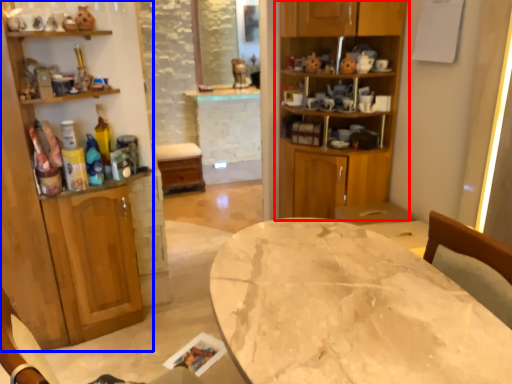
Question: Which object appears closest to the camera in this image, cabinetry (highlighted by a red box) or cabinetry (highlighted by a blue box)?

Choices:
 (A) cabinetry
 (B) cabinetry

Answer: (B)